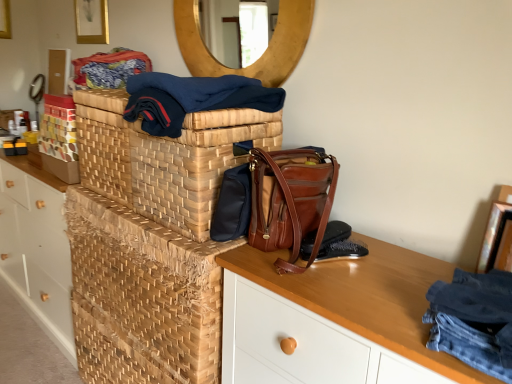
You are a GUI agent. You are given a task and a screenshot of the screen. Output one action in this format:
    pyautogui.click(x=<x>, y=<y>)
    Task: Click on the free area in between denim jeans at right, which ranks as the first clothing in front-to-back order, and black leather shoe at lower right, acting as the first shoe starting from the top
    This screenshot has height=384, width=512.
    Given the screenshot: What is the action you would take?
    pyautogui.click(x=374, y=293)